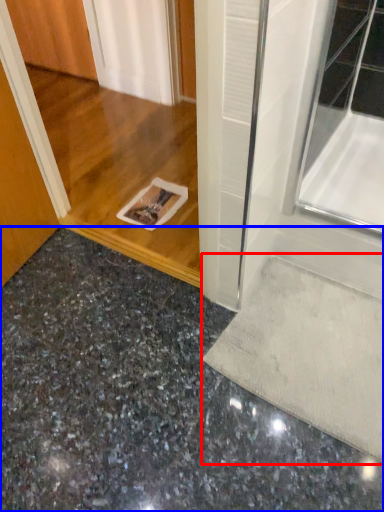
Question: Which point is further to the camera, doormat (highlighted by a red box) or concrete (highlighted by a blue box)?

Choices:
 (A) doormat
 (B) concrete

Answer: (A)